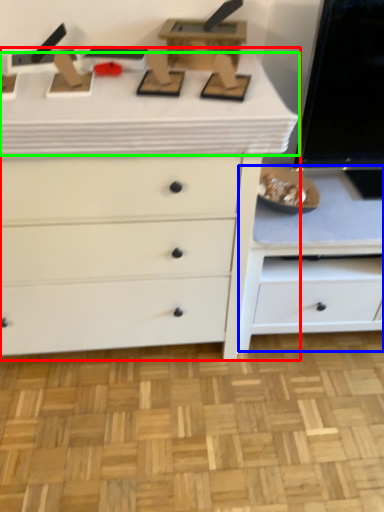
Question: Which object is the closest to the chest of drawers (highlighted by a red box)? Choose among these: cabinetry (highlighted by a blue box) or counter top (highlighted by a green box).

Choices:
 (A) cabinetry
 (B) counter top

Answer: (B)